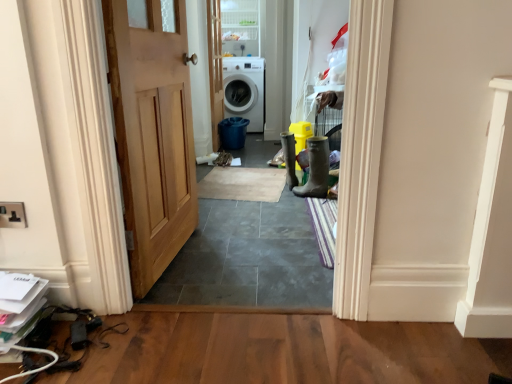
Where is `vacant space behind natural wood door at center, acting as the first door starting from the front`? The image size is (512, 384). vacant space behind natural wood door at center, acting as the first door starting from the front is located at coordinates (223, 222).